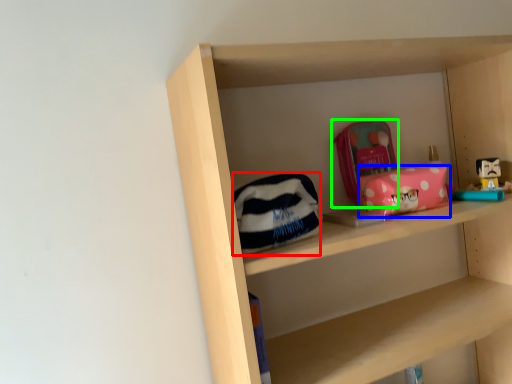
Question: Based on their relative distances, which object is nearer to pouch (highlighted by a red box)? Choose from package (highlighted by a blue box) and pouch (highlighted by a green box).

Choices:
 (A) package
 (B) pouch

Answer: (A)